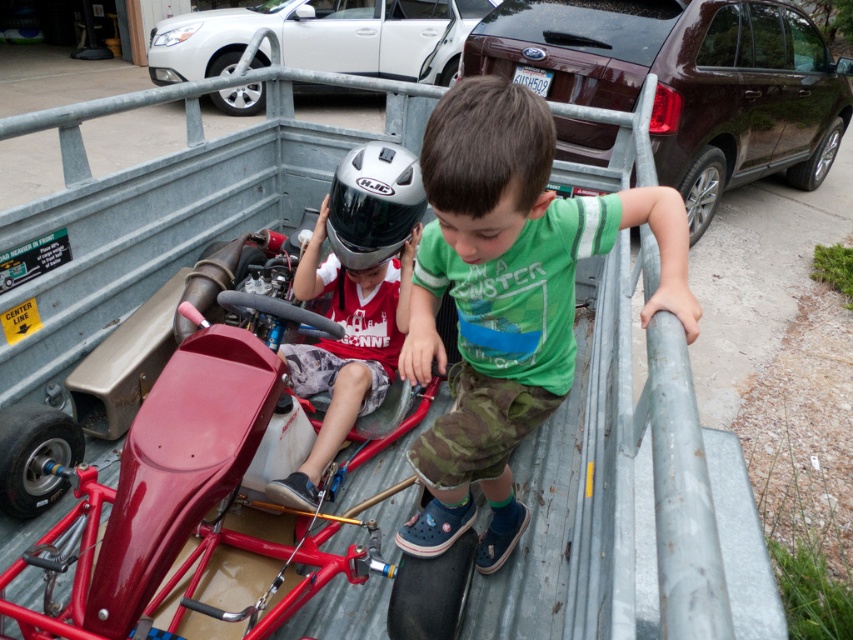
Question: Is brown metallic suv at upper right below silver matte helmet at center?

Choices:
 (A) yes
 (B) no

Answer: (B)

Question: Does silver metallic sedan at upper left have a smaller size compared to silver matte helmet at center?

Choices:
 (A) yes
 (B) no

Answer: (B)

Question: Which point is farther to the camera?

Choices:
 (A) silver metallic sedan at upper left
 (B) silver metallic helmet at center
 (C) brown metallic suv at upper right
 (D) silver matte helmet at center

Answer: (A)

Question: Among these objects, which one is farthest from the camera?

Choices:
 (A) silver metallic helmet at center
 (B) green cotton shirt at center
 (C) silver matte helmet at center

Answer: (C)

Question: Among these objects, which one is nearest to the camera?

Choices:
 (A) silver metallic helmet at center
 (B) green cotton shirt at center

Answer: (B)

Question: Does brown metallic suv at upper right have a lesser width compared to silver metallic helmet at center?

Choices:
 (A) no
 (B) yes

Answer: (A)